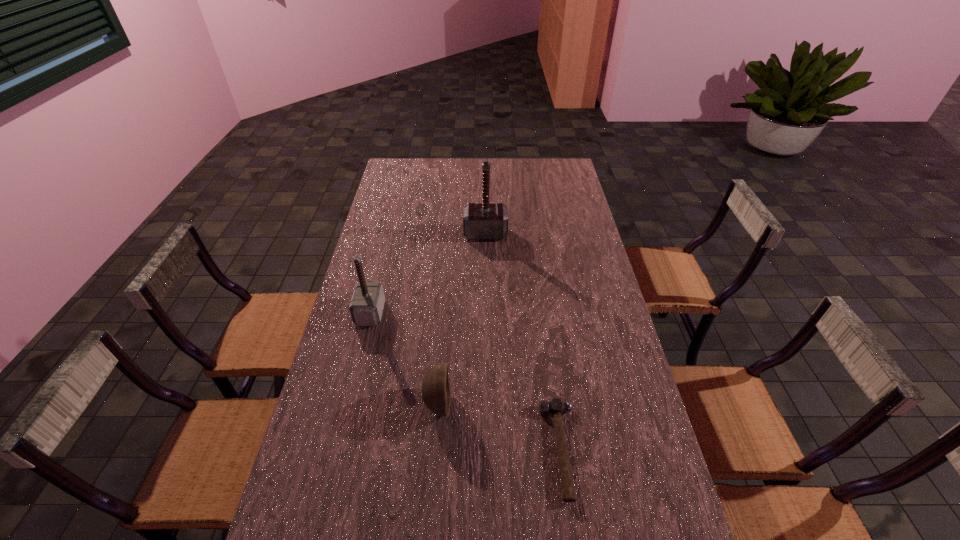
Identify the location of the third object from left to right. (483, 221).

Find the location of a particular element. the farthest hammer is located at coordinates (483, 221).

This screenshot has width=960, height=540. In order to click on the second nearest hammer in this screenshot , I will do `click(366, 307)`.

Find the location of a particular element. Image resolution: width=960 pixels, height=540 pixels. the second farthest object is located at coordinates (366, 307).

Identify the location of the third tallest object. This screenshot has width=960, height=540. (436, 392).

At what (x,y) coordinates should I click in order to perform the action: click on the third object from right to left. Please return your answer as a coordinate pair (x, y). Image resolution: width=960 pixels, height=540 pixels. Looking at the image, I should click on (436, 392).

Image resolution: width=960 pixels, height=540 pixels. Identify the location of the rightmost object. (556, 407).

Locate an element on the screen. This screenshot has width=960, height=540. the nearest hammer is located at coordinates (556, 407).

Image resolution: width=960 pixels, height=540 pixels. I want to click on vacant region located on the back of the farthest hammer, so click(x=485, y=186).

At what (x,y) coordinates should I click in order to perform the action: click on vacant region located 0.080m for striking with the head of the second shortest hammer. Please return your answer as a coordinate pair (x, y). The width and height of the screenshot is (960, 540). Looking at the image, I should click on (408, 313).